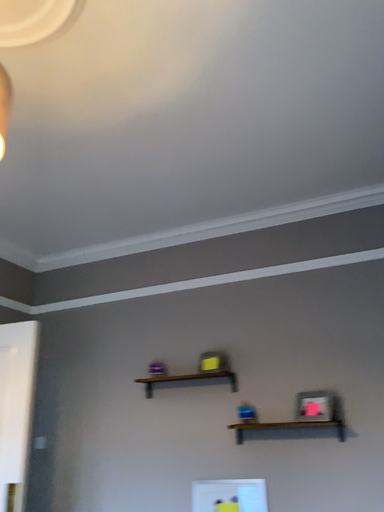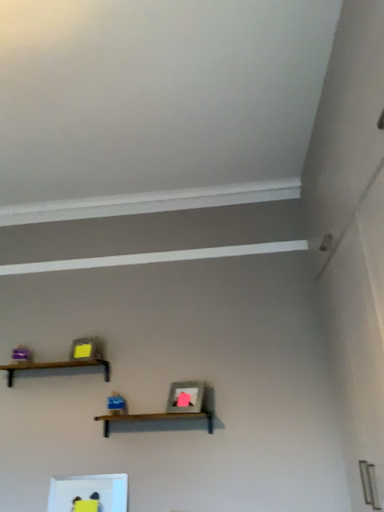
Question: How did the camera likely rotate when shooting the video?

Choices:
 (A) rotated right
 (B) rotated left

Answer: (A)